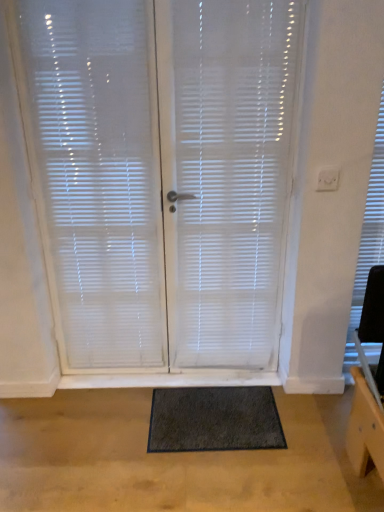
Question: Is white painted wood at lower center next to dark gray shaggy mat at center and touching it?

Choices:
 (A) yes
 (B) no

Answer: (B)

Question: Can you confirm if white painted wood at lower center is taller than dark gray shaggy mat at center?

Choices:
 (A) yes
 (B) no

Answer: (B)

Question: Is white painted wood at lower center oriented away from dark gray shaggy mat at center?

Choices:
 (A) yes
 (B) no

Answer: (A)

Question: Is white painted wood at lower center thinner than dark gray shaggy mat at center?

Choices:
 (A) no
 (B) yes

Answer: (B)

Question: From the image's perspective, is white painted wood at lower center on dark gray shaggy mat at center?

Choices:
 (A) no
 (B) yes

Answer: (B)

Question: Does white painted wood at lower center have a lesser height compared to dark gray shaggy mat at center?

Choices:
 (A) no
 (B) yes

Answer: (B)

Question: From the image's perspective, would you say dark gray shaggy mat at center is shown under white translucent blinds at center?

Choices:
 (A) yes
 (B) no

Answer: (A)

Question: Considering the relative sizes of dark gray shaggy mat at center and white translucent blinds at center in the image provided, is dark gray shaggy mat at center bigger than white translucent blinds at center?

Choices:
 (A) yes
 (B) no

Answer: (B)

Question: From a real-world perspective, is dark gray shaggy mat at center physically above white translucent blinds at center?

Choices:
 (A) no
 (B) yes

Answer: (A)

Question: Are dark gray shaggy mat at center and white translucent blinds at center making contact?

Choices:
 (A) no
 (B) yes

Answer: (A)

Question: Considering the relative sizes of dark gray shaggy mat at center and white translucent blinds at center in the image provided, is dark gray shaggy mat at center taller than white translucent blinds at center?

Choices:
 (A) yes
 (B) no

Answer: (B)

Question: From a real-world perspective, is dark gray shaggy mat at center under white translucent blinds at center?

Choices:
 (A) no
 (B) yes

Answer: (B)

Question: Can you confirm if white painted wood at lower center is smaller than white translucent blinds at center?

Choices:
 (A) yes
 (B) no

Answer: (A)